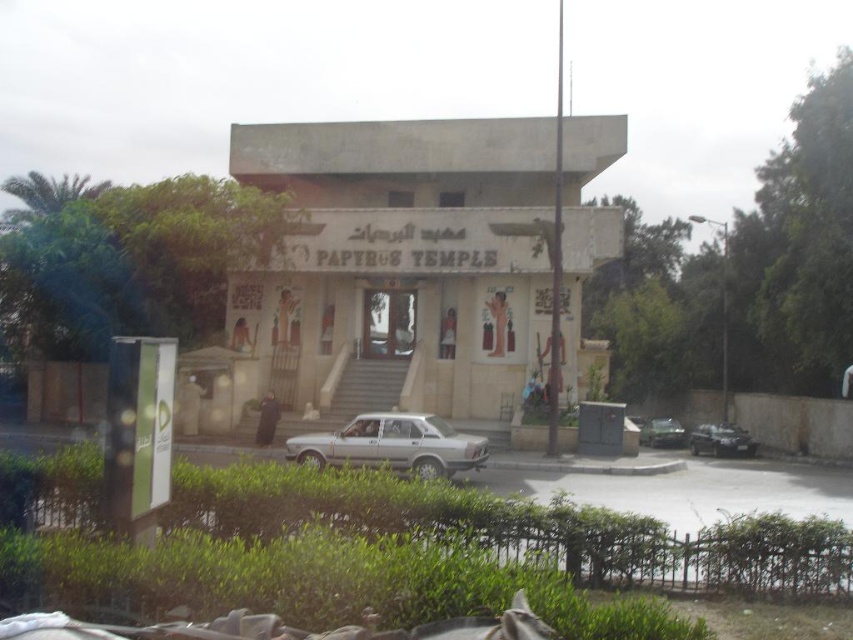
You are a delivery driver who needs to park your truck, which is 2 meters tall, in the parking area in front of the Papyrus Temple. The parking area has two sedans parked at center. Which of the two sedans, the silver metallic sedan at center or the satin silver sedan at center, is shorter and can allow your truck to pass over it if necessary?

The silver metallic sedan at center has a lesser height compared to the satin silver sedan at center, so the truck can pass over the silver metallic sedan at center since it is shorter.

You are a visitor arriving at the Papyrus Temple and want to park your car. You see two cars at the center area, a silver metallic sedan at center and a satin silver sedan at center. Which one is closer to the entrance of the temple?

The silver metallic sedan at center is closer to the entrance because it is positioned to the left of the satin silver sedan at center, and since the entrance is at the front of the temple, the leftmost car would be nearest to it.